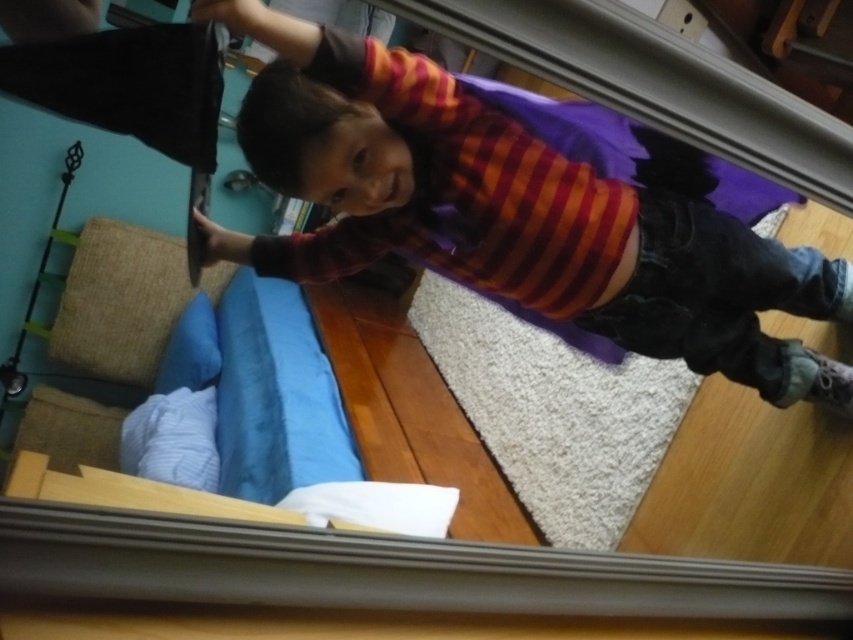
Question: Can you confirm if purple matte cape at upper center is positioned to the left of brown textured cushion at lower left?

Choices:
 (A) yes
 (B) no

Answer: (B)

Question: From the image, what is the correct spatial relationship of brown textured cushion at lower left in relation to white textured pillow at lower left?

Choices:
 (A) below
 (B) above

Answer: (B)

Question: Which point is closer to the camera taking this photo?

Choices:
 (A) (207, 460)
 (B) (183, 317)
 (C) (148, 237)
 (D) (270, 173)

Answer: (D)

Question: Does purple matte cape at upper center lie in front of brown textured cushion at lower left?

Choices:
 (A) no
 (B) yes

Answer: (B)

Question: Which point appears closest to the camera in this image?

Choices:
 (A) (260, 129)
 (B) (146, 461)

Answer: (A)

Question: Estimate the real-world distances between objects in this image. Which object is closer to the blue soft pillow at lower left?

Choices:
 (A) white textured pillow at lower left
 (B) purple matte cape at upper center

Answer: (A)